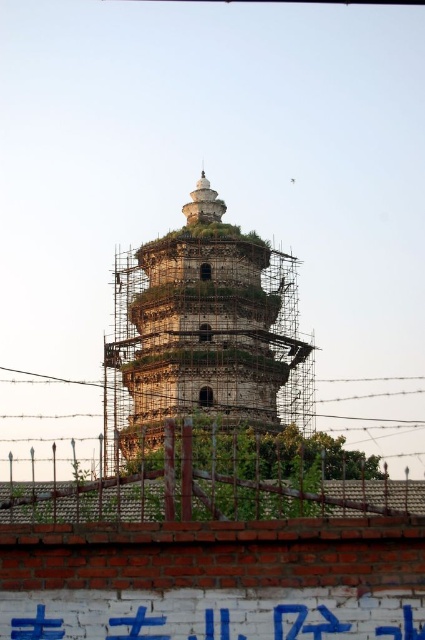
Does point (116, 449) lie in front of point (396, 380)?

Yes, it is.

Between point (119, 316) and point (340, 397), which one is positioned in front?

Positioned in front is point (119, 316).

In order to click on stone pagoda at center in this screenshot , I will do `click(203, 333)`.

Is stone pagoda at center to the right of white painted brick wall at lower center from the viewer's perspective?

In fact, stone pagoda at center is to the left of white painted brick wall at lower center.

Does stone pagoda at center appear over white painted brick wall at lower center?

Yes, stone pagoda at center is above white painted brick wall at lower center.

Identify the location of stone pagoda at center. (203, 333).

Is point (133, 620) positioned behind point (373, 448)?

No, it is not.

Which is more to the left, white painted brick wall at lower center or barbed wire at lower center?

From the viewer's perspective, barbed wire at lower center appears more on the left side.

Identify the location of white painted brick wall at lower center. The image size is (425, 640). (212, 620).

Locate an element on the screen. white painted brick wall at lower center is located at coordinates (212, 620).